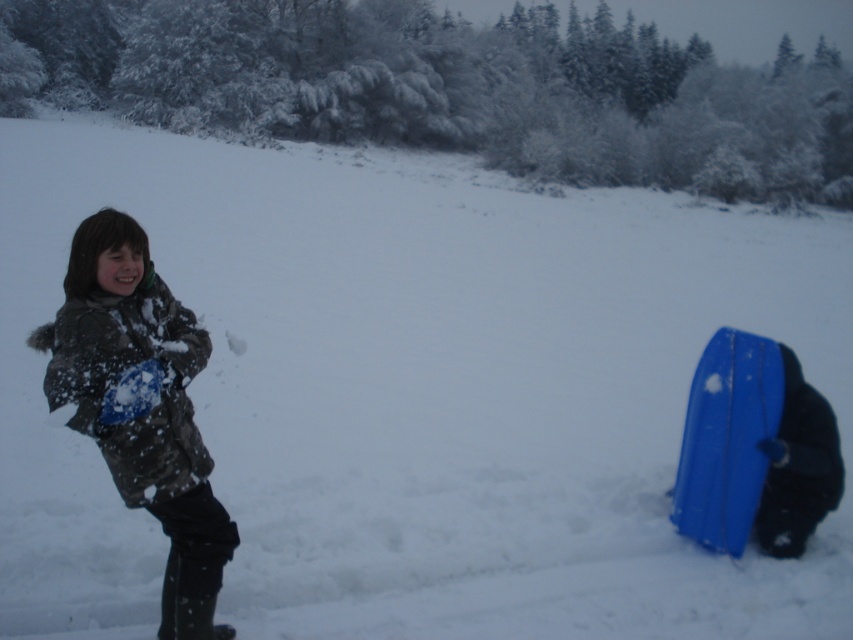
Question: Is snow-covered jacket at left further to camera compared to blue plastic snowboard at lower right?

Choices:
 (A) yes
 (B) no

Answer: (B)

Question: Is snow-covered jacket at left thinner than blue plastic snowboard at lower right?

Choices:
 (A) no
 (B) yes

Answer: (B)

Question: Is snow-covered jacket at left to the right of blue plastic snowboard at lower right from the viewer's perspective?

Choices:
 (A) yes
 (B) no

Answer: (B)

Question: Which point is closer to the camera taking this photo?

Choices:
 (A) (222, 561)
 (B) (722, 547)

Answer: (A)

Question: Which object appears farthest from the camera in this image?

Choices:
 (A) blue plastic snowboard at lower right
 (B) snow-covered jacket at left

Answer: (A)

Question: Which point is farther to the camera?

Choices:
 (A) (183, 477)
 (B) (720, 531)

Answer: (B)